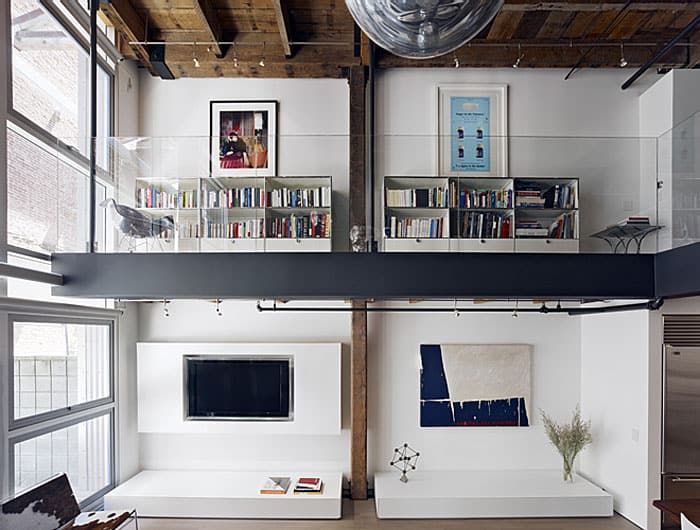
Find the location of a particular element. The image size is (700, 530). tv is located at coordinates (267, 384).